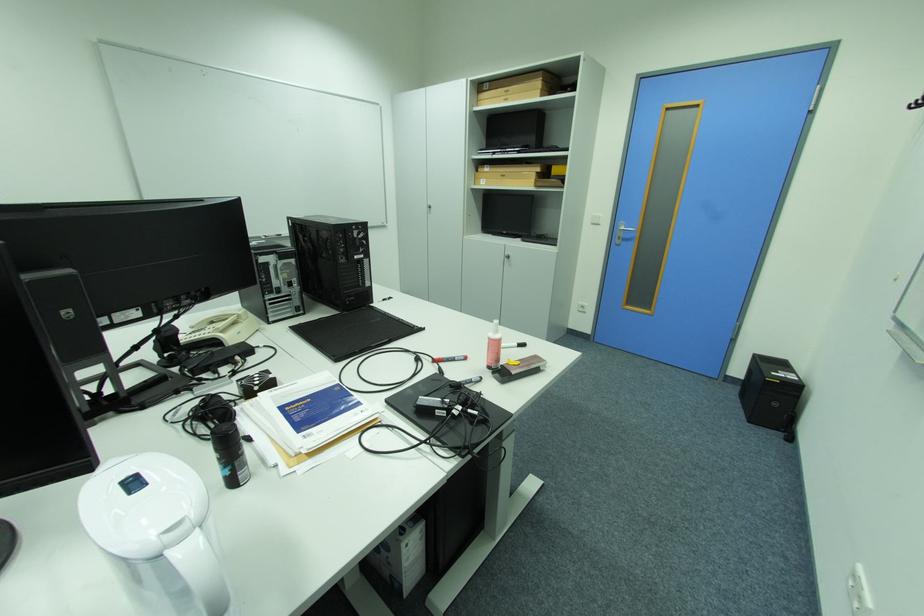
Where is `telephone handset`? telephone handset is located at coordinates (222, 318).